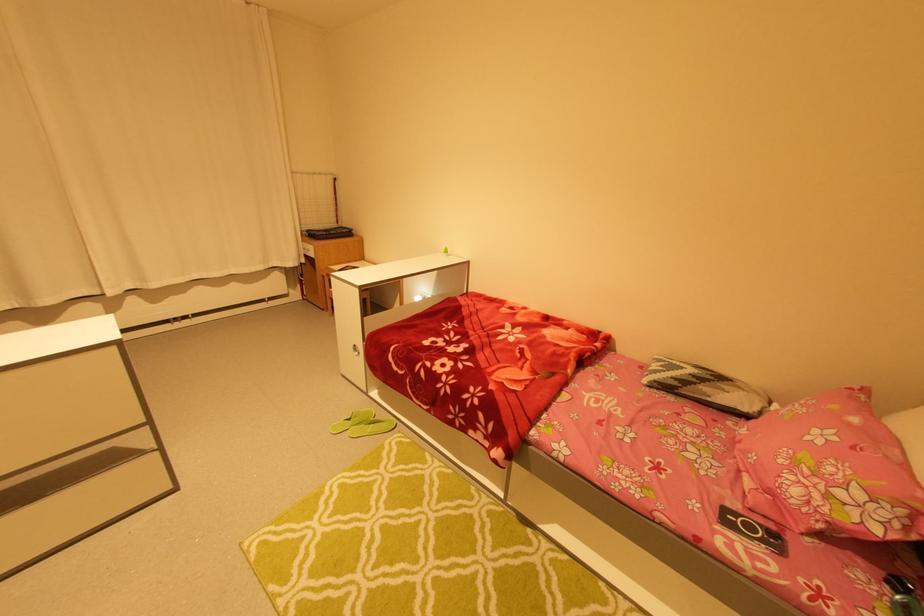
Find where to lift the pink floral pillow. Please return your answer as a coordinate pair (x, y).

(828, 467)